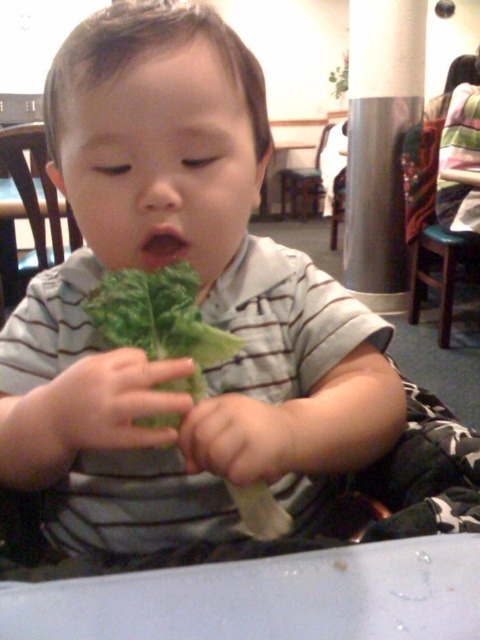
Question: Which object is positioned farthest from the metallic silver chair at upper center?

Choices:
 (A) green fabric chair at right
 (B) green leafy at center
 (C) wooden chair at left

Answer: (B)

Question: Does green fabric chair at right appear on the left side of wooden chair at left?

Choices:
 (A) yes
 (B) no

Answer: (B)

Question: Which object appears closest to the camera in this image?

Choices:
 (A) wooden chair at left
 (B) green fabric chair at right
 (C) green leafy at center

Answer: (C)

Question: Can you confirm if green leafy at center is positioned below green fabric chair at right?

Choices:
 (A) yes
 (B) no

Answer: (A)

Question: Is green fabric chair at right to the right of wooden chair at left from the viewer's perspective?

Choices:
 (A) no
 (B) yes

Answer: (B)

Question: Among these objects, which one is nearest to the camera?

Choices:
 (A) green fabric chair at right
 (B) wooden chair at left
 (C) metallic silver chair at upper center

Answer: (B)